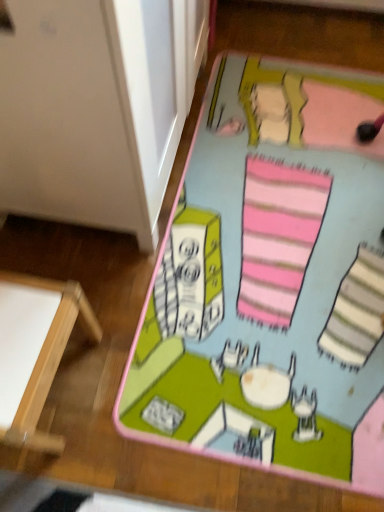
The image size is (384, 512). I want to click on free space to the back side of white wood table at lower left, so click(80, 262).